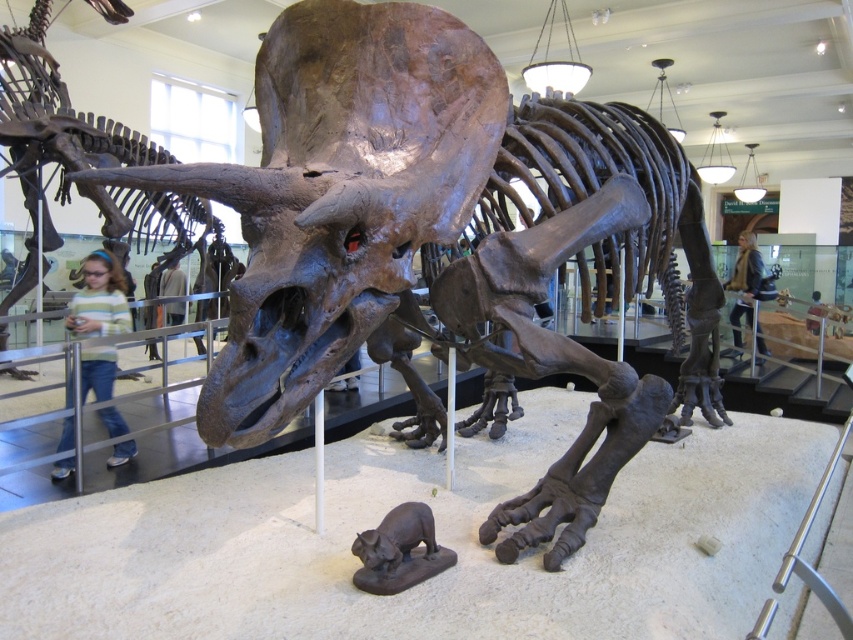
Is the position of rusty metallic dinosaur at center less distant than that of shiny black statue at lower center?

No, rusty metallic dinosaur at center is behind shiny black statue at lower center.

This screenshot has width=853, height=640. Describe the element at coordinates (51, 138) in the screenshot. I see `rusty metallic dinosaur at center` at that location.

Identify the location of rusty metallic dinosaur at center. (51, 138).